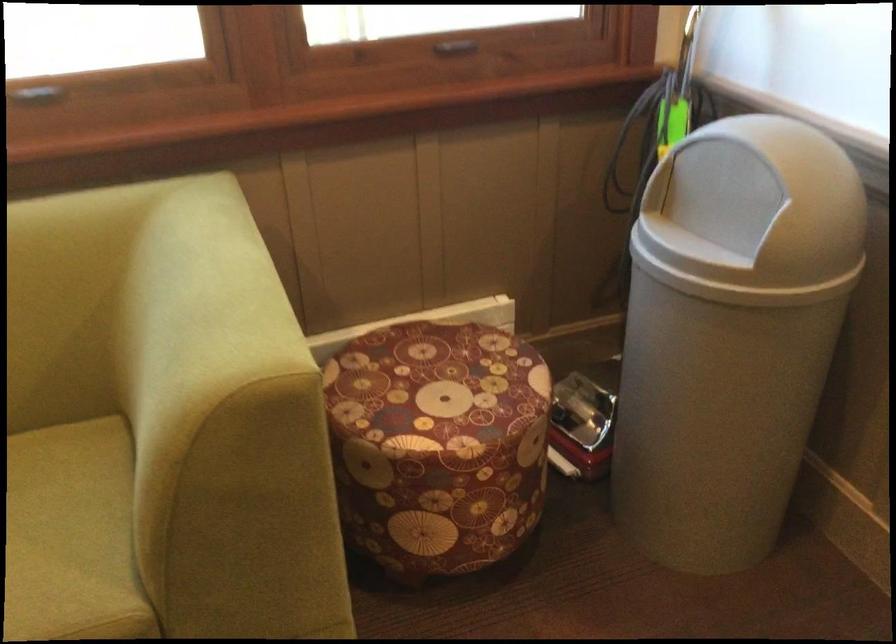
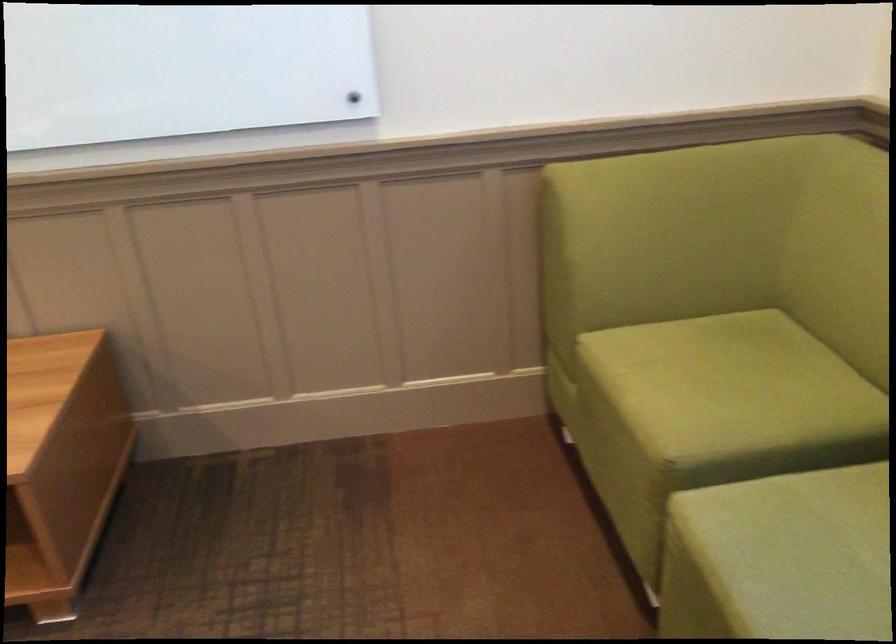
The first image is from the beginning of the video and the second image is from the end. How did the camera likely rotate when shooting the video?

The camera's rotation is toward left-down.